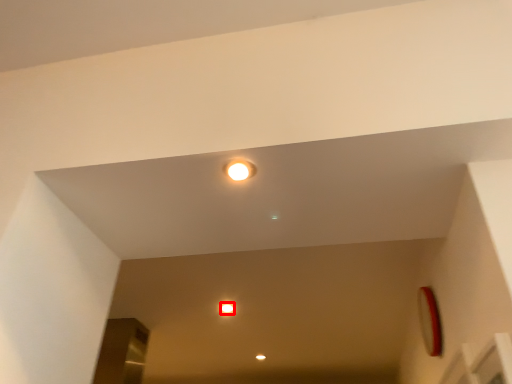
Question: From the image's perspective, what is the correct spatial positioning of dot (annotated by the red box) in reference to light?

Choices:
 (A) above
 (B) below

Answer: (B)